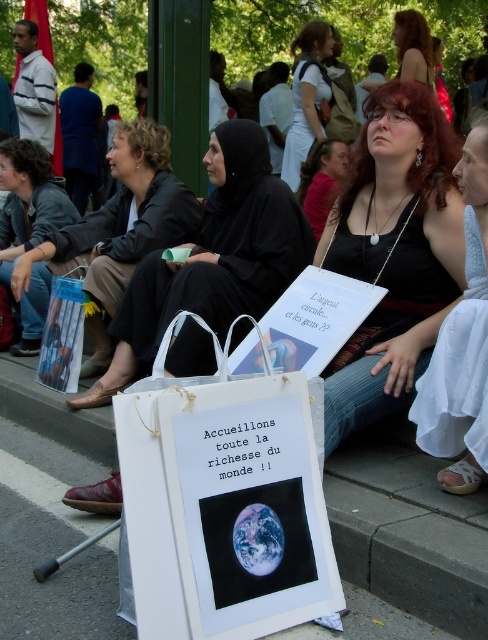
Which is more to the left, matte black tank top at center or black fabric hijab at center?

black fabric hijab at center is more to the left.

Is point (422, 355) positioned after point (246, 168)?

That is False.

Is point (443, 182) positioned in front of point (105, 388)?

That is True.

Locate an element on the screen. The height and width of the screenshot is (640, 488). matte black tank top at center is located at coordinates (393, 253).

Is matte black tank top at center to the left of white satin dress at center from the viewer's perspective?

Yes, matte black tank top at center is to the left of white satin dress at center.

Is point (436, 330) positioned in front of point (469, 348)?

No, (436, 330) is behind (469, 348).

Does point (361, 163) lie behind point (430, 385)?

Yes, it is behind point (430, 385).

Where is `matte black tank top at center`? Image resolution: width=488 pixels, height=640 pixels. matte black tank top at center is located at coordinates (393, 253).

Who is more forward, (462, 433) or (7, 278)?

Point (462, 433) is more forward.

Is white satin dress at center smaller than denim jacket at left?

Correct, white satin dress at center occupies less space than denim jacket at left.

Identify the location of white satin dress at center. (462, 342).